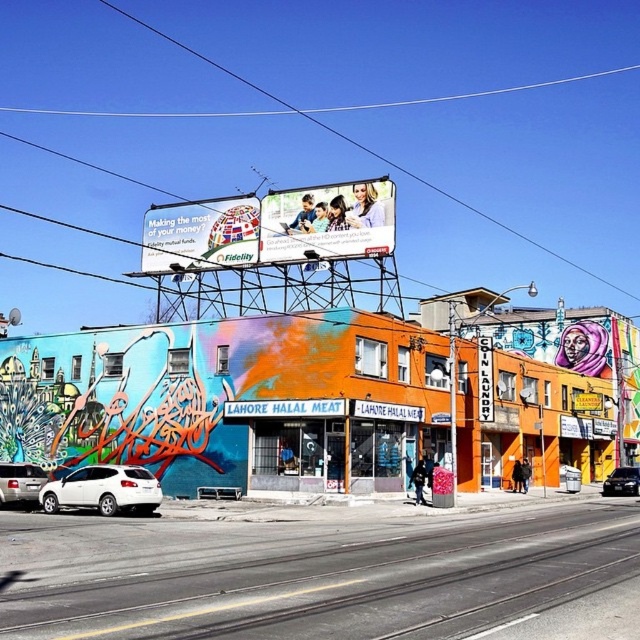
Is matte plastic billboard at center shorter than white paper billboard at upper center?

Yes.

Is point (308, 227) behind point (228, 211)?

No, (308, 227) is closer to viewer.

Image resolution: width=640 pixels, height=640 pixels. Find the location of `matte plastic billboard at center`. matte plastic billboard at center is located at coordinates (328, 221).

Can you confirm if white paper billboard at upper center is thinner than orange painted sign at center?

In fact, white paper billboard at upper center might be wider than orange painted sign at center.

Identify the location of white paper billboard at upper center. (198, 234).

At what (x,y) coordinates should I click in order to perform the action: click on white paper billboard at upper center. Please return your answer as a coordinate pair (x, y). This screenshot has width=640, height=640. Looking at the image, I should click on (198, 234).

Between white matte suv at lower left and black glossy sedan at center, which one is positioned higher?

Positioned higher is white matte suv at lower left.

Which is more to the right, white matte suv at lower left or black glossy sedan at center?

black glossy sedan at center is more to the right.

Is point (124, 484) more distant than point (605, 490)?

That is False.

Identify the location of white matte suv at lower left. click(x=104, y=490).